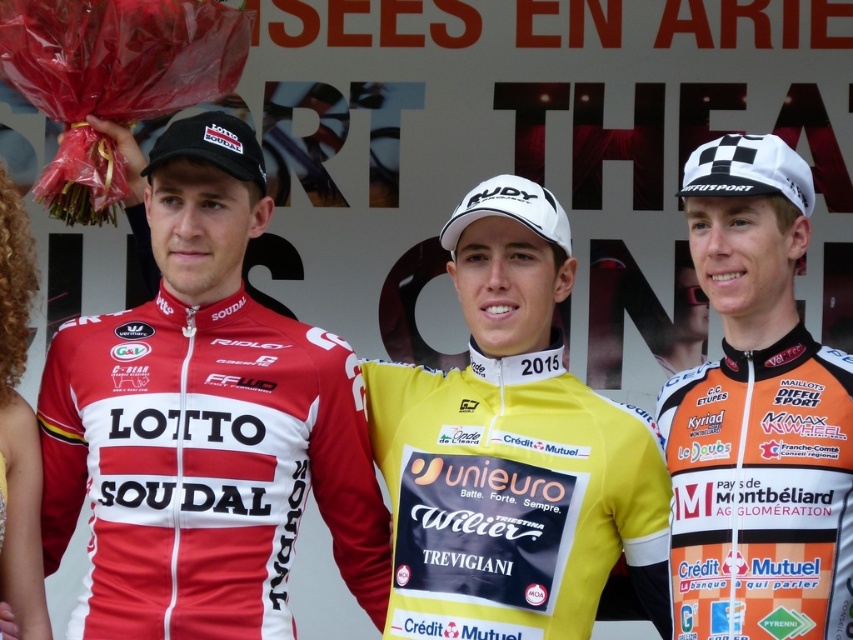
Question: Among these points, which one is nearest to the camera?

Choices:
 (A) (799, 161)
 (B) (503, 454)
 (C) (692, 401)

Answer: (A)

Question: Can you confirm if matte red jersey at center is wider than yellow jersey at center?

Choices:
 (A) no
 (B) yes

Answer: (B)

Question: Which object appears closest to the camera in this image?

Choices:
 (A) white checkered fabric cap at upper right
 (B) yellow jersey at center
 (C) matte red jersey at center

Answer: (B)

Question: Estimate the real-world distances between objects in this image. Which object is closer to the white checkered fabric cap at upper right?

Choices:
 (A) matte red jersey at center
 (B) orange jersey at right

Answer: (B)

Question: Where is matte red jersey at center located in relation to yellow jersey at center in the image?

Choices:
 (A) right
 (B) left

Answer: (B)

Question: Can you confirm if yellow jersey at center is thinner than orange jersey at right?

Choices:
 (A) no
 (B) yes

Answer: (A)